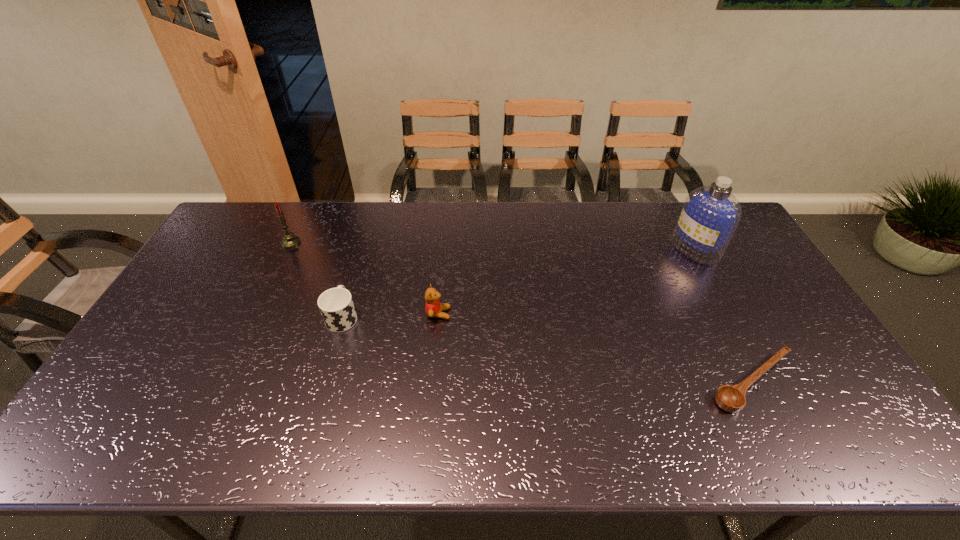
Where is `empty space that is in between the third tallest object and the leftmost object`? The height and width of the screenshot is (540, 960). empty space that is in between the third tallest object and the leftmost object is located at coordinates (365, 278).

This screenshot has height=540, width=960. Identify the location of free spot between the shortest object and the leftmost object. (522, 313).

Find the location of a particular element. The height and width of the screenshot is (540, 960). free space between the candle and the nearest object is located at coordinates (522, 313).

Where is `free spot between the third tallest object and the second tallest object`? free spot between the third tallest object and the second tallest object is located at coordinates (365, 278).

I want to click on free spot between the tallest object and the leftmost object, so click(493, 246).

I want to click on empty space that is in between the nearest object and the cleansing agent, so click(724, 315).

Identify which object is the third nearest to the tallest object. Please provide its 2D coordinates. Your answer should be formatted as a tuple, i.e. [(x, y)], where the tuple contains the x and y coordinates of a point satisfying the conditions above.

[(336, 305)]

The height and width of the screenshot is (540, 960). Find the location of `the fourth closest object relative to the leftmost object`. the fourth closest object relative to the leftmost object is located at coordinates (710, 214).

I want to click on vacant region that satisfies the following two spatial constraints: 1. on the front-facing side of the third tallest object; 2. on the back side of the nearest object, so click(x=432, y=382).

What are the coordinates of `free space in the image that satisfies the following two spatial constraints: 1. on the side of the fourth tallest object with the handle; 2. on the right side of the tallest object` in the screenshot? It's located at 363,248.